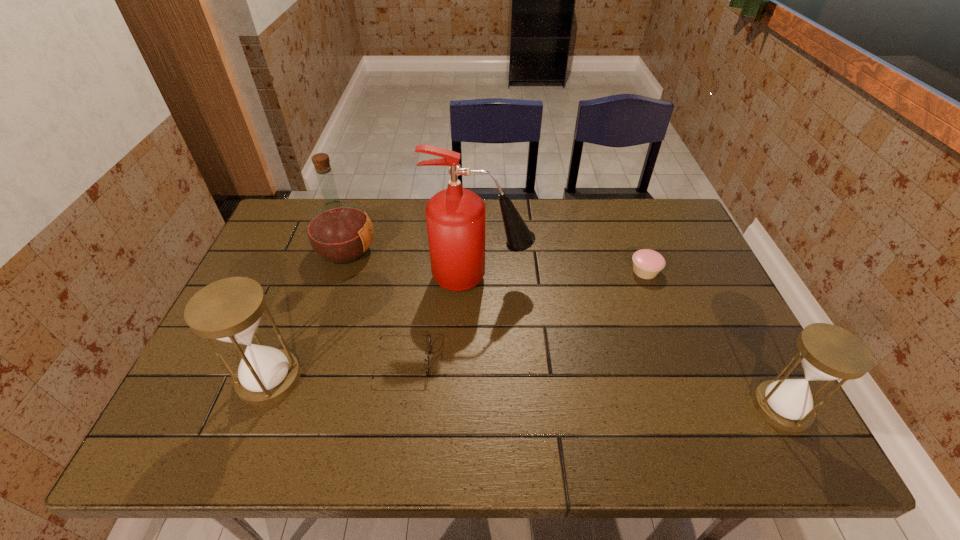
The height and width of the screenshot is (540, 960). Identify the location of the closest object to the tallest object. (429, 349).

Locate an element on the screen. This screenshot has height=540, width=960. object that is the third nearest to the fifth shortest object is located at coordinates (229, 310).

Where is `free location that satisfies the following two spatial constraints: 1. on the front label of the cupcake; 2. on the right side of the fifth shortest object`? This screenshot has height=540, width=960. free location that satisfies the following two spatial constraints: 1. on the front label of the cupcake; 2. on the right side of the fifth shortest object is located at coordinates (339, 271).

The width and height of the screenshot is (960, 540). In order to click on vacant area in the image that satisfies the following two spatial constraints: 1. on the front side of the second shortest object; 2. with the nozzle aimed from the tallest object in this screenshot , I will do `click(647, 278)`.

You are a GUI agent. You are given a task and a screenshot of the screen. Output one action in this format:
    pyautogui.click(x=<x>, y=<y>)
    Task: Click on the vacant space that satisfies the following two spatial constraints: 1. on the front-facing side of the shorter hourglass; 2. on the left side of the shortest object
    Image resolution: width=960 pixels, height=540 pixels.
    Given the screenshot: What is the action you would take?
    pyautogui.click(x=396, y=407)

Locate an element on the screen. This screenshot has height=540, width=960. free space that satisfies the following two spatial constraints: 1. on the front-facing side of the shorter hourglass; 2. on the left side of the shortest object is located at coordinates (396, 407).

You are a GUI agent. You are given a task and a screenshot of the screen. Output one action in this format:
    pyautogui.click(x=<x>, y=<y>)
    Task: Click on the free point that satisfies the following two spatial constraints: 1. on the front-facing side of the rightmost object; 2. on the left side of the sunglasses
    The width and height of the screenshot is (960, 540).
    Given the screenshot: What is the action you would take?
    pyautogui.click(x=396, y=407)

This screenshot has height=540, width=960. I want to click on vacant region that satisfies the following two spatial constraints: 1. on the front label of the fifth object from left to right; 2. on the left side of the liquor, so click(x=339, y=271).

This screenshot has height=540, width=960. What are the coordinates of `vacant space that satisfies the following two spatial constraints: 1. on the front-facing side of the sunglasses; 2. on the front side of the third tallest object` in the screenshot? It's located at (401, 379).

Identify the location of vacant space that satisfies the following two spatial constraints: 1. with the nozzle aimed from the tallest object; 2. on the right side of the third shortest object. Image resolution: width=960 pixels, height=540 pixels. (480, 407).